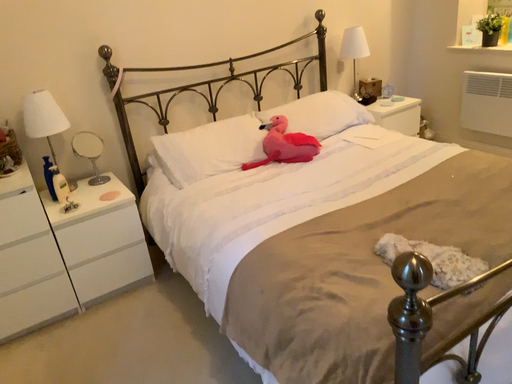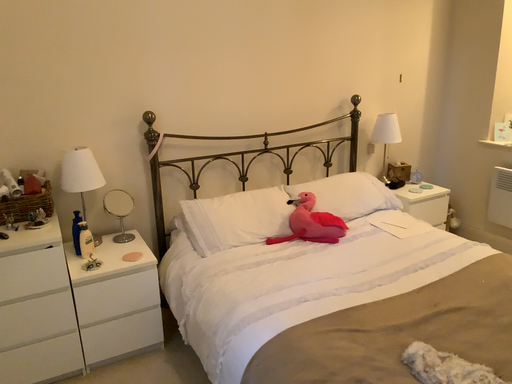
Question: Which way did the camera rotate in the video?

Choices:
 (A) rotated downward
 (B) rotated upward

Answer: (B)